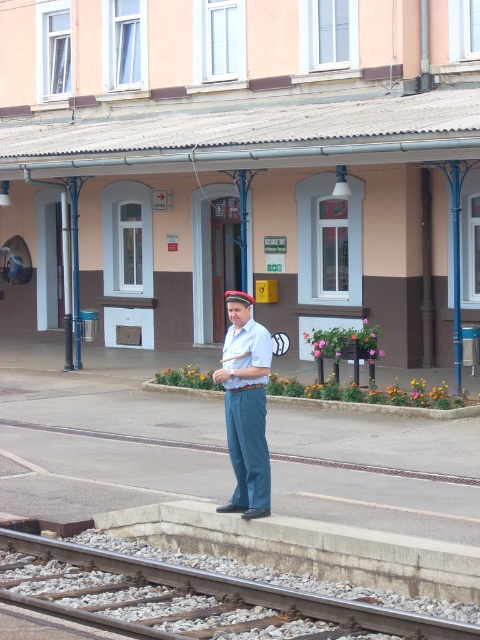
Does smooth metal rail at lower center lie behind blue cotton pants at center?

No, it is not.

Who is positioned more to the right, smooth metal rail at lower center or blue cotton pants at center?

blue cotton pants at center is more to the right.

Is point (371, 618) less distant than point (267, 474)?

Yes, it is in front of point (267, 474).

Image resolution: width=480 pixels, height=640 pixels. Identify the location of smooth metal rail at lower center. (192, 598).

Consider the image. Does beige concrete platform at center have a lesser width compared to blue cotton pants at center?

In fact, beige concrete platform at center might be wider than blue cotton pants at center.

Which is in front, point (299, 77) or point (240, 292)?

Positioned in front is point (240, 292).

The image size is (480, 640). Find the location of `beige concrete platform at center`. beige concrete platform at center is located at coordinates (263, 196).

Does beige concrete platform at center appear on the right side of smooth metal rail at lower center?

In fact, beige concrete platform at center is to the left of smooth metal rail at lower center.

Is point (96, 138) positioned in front of point (154, 618)?

No, (96, 138) is further to viewer.

Where is `beige concrete platform at center`? This screenshot has height=640, width=480. beige concrete platform at center is located at coordinates (263, 196).